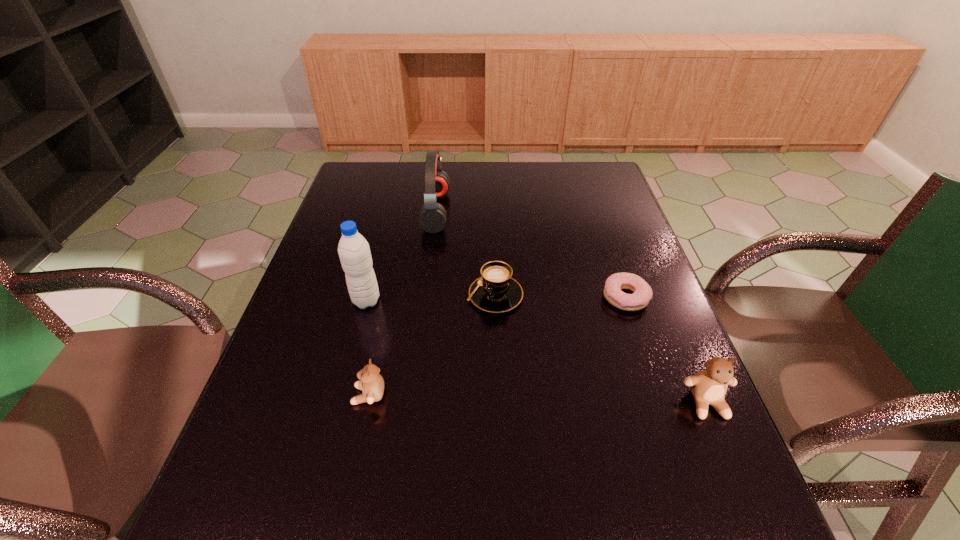
Identify the location of empty space that is in between the right teddy bear and the tallest object. (537, 352).

The image size is (960, 540). I want to click on vacant point located between the tallest object and the third tallest object, so click(x=537, y=352).

Image resolution: width=960 pixels, height=540 pixels. In order to click on empty location between the farthest object and the third shortest object in this screenshot , I will do `click(402, 303)`.

The height and width of the screenshot is (540, 960). Find the location of `vacant space in between the water bottle and the cappuccino`. vacant space in between the water bottle and the cappuccino is located at coordinates (431, 298).

I want to click on empty space between the earphone and the right teddy bear, so click(571, 307).

You are a GUI agent. You are given a task and a screenshot of the screen. Output one action in this format:
    pyautogui.click(x=<x>, y=<y>)
    Task: Click on the free space between the cappuccino and the fifth shortest object
    Image resolution: width=960 pixels, height=540 pixels.
    Given the screenshot: What is the action you would take?
    pyautogui.click(x=466, y=253)

At what (x,y) coordinates should I click in order to perform the action: click on object that is the third nearest to the second tallest object. Please return your answer as a coordinate pair (x, y). The image size is (960, 540). Looking at the image, I should click on (615, 283).

Image resolution: width=960 pixels, height=540 pixels. In order to click on object that is the fifth nearest to the right teddy bear in this screenshot , I will do `click(432, 218)`.

You are a GUI agent. You are given a task and a screenshot of the screen. Output one action in this format:
    pyautogui.click(x=<x>, y=<y>)
    Task: Click on the vacant space that satisfies the following two spatial constraints: 1. on the ear cups of the farthest object; 2. on the front side of the water bottle
    
    Given the screenshot: What is the action you would take?
    [x=424, y=301]

What are the coordinates of `blank space that satisfies the following two spatial constraints: 1. on the ear cups of the second tallest object; 2. on the back side of the doughnut` in the screenshot? It's located at (425, 297).